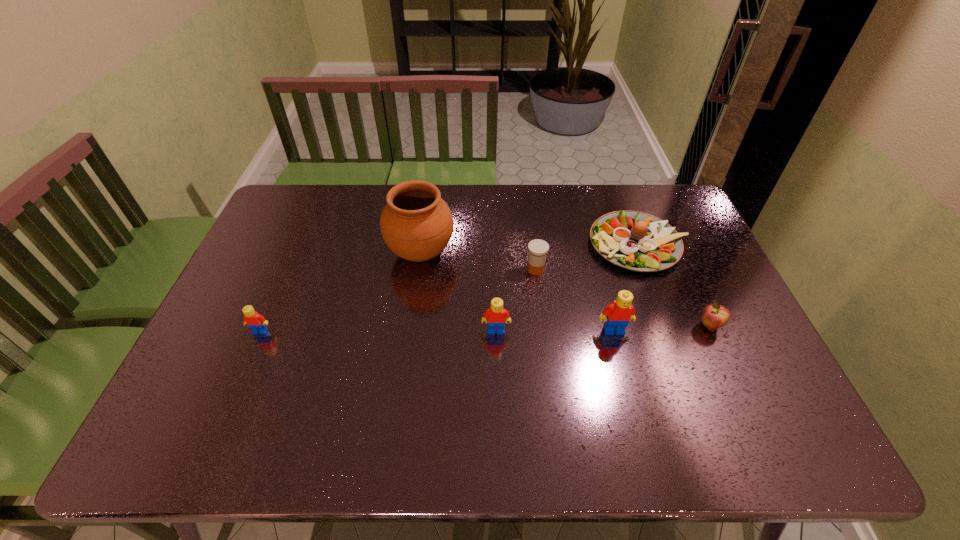
I want to click on the leftmost Lego, so click(256, 322).

At what (x,y) coordinates should I click in order to perform the action: click on the leftmost object. Please return your answer as a coordinate pair (x, y). Looking at the image, I should click on (256, 322).

Identify the location of the second Lego from left to right. (497, 316).

The width and height of the screenshot is (960, 540). In order to click on the third tallest object in this screenshot , I will do [x=497, y=316].

Locate an element on the screen. The image size is (960, 540). the rightmost Lego is located at coordinates (617, 315).

The height and width of the screenshot is (540, 960). I want to click on the tallest Lego, so point(617,315).

Identify the location of the sixth object from right to left. [x=416, y=224].

Identify the location of pottery. (416, 224).

The image size is (960, 540). I want to click on salad plate, so click(x=637, y=241).

This screenshot has width=960, height=540. In order to click on medicine in this screenshot , I will do `click(538, 249)`.